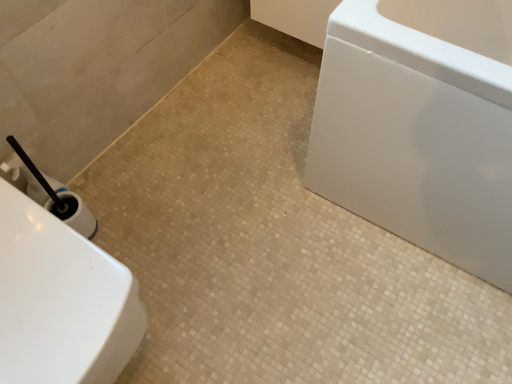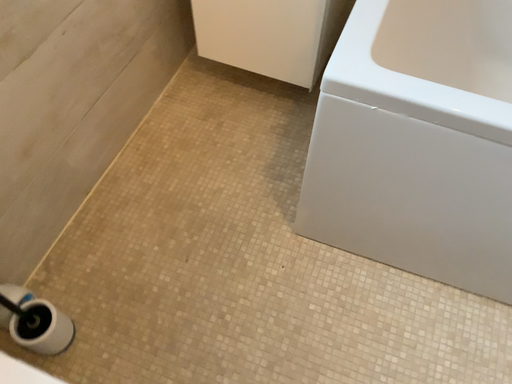
Question: Which way did the camera rotate in the video?

Choices:
 (A) rotated left
 (B) rotated right

Answer: (B)